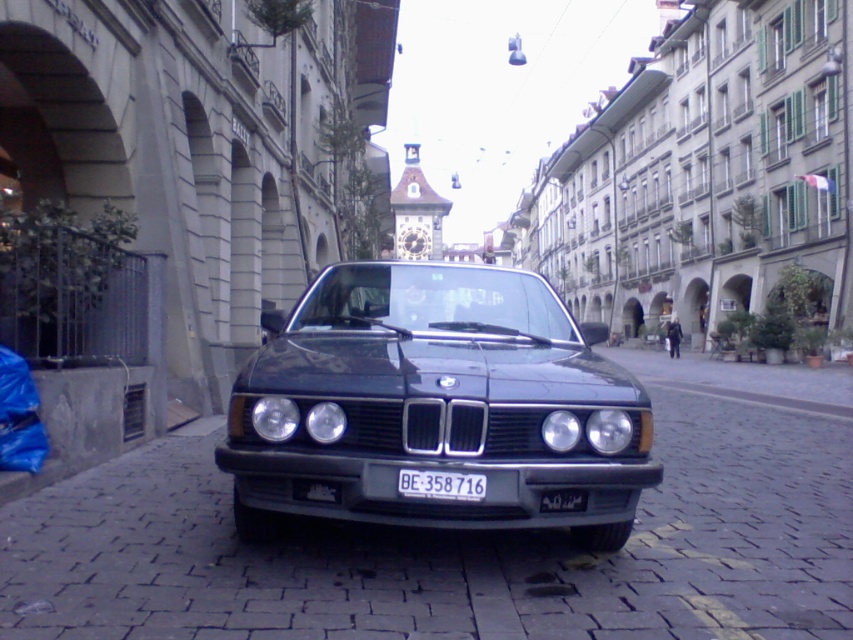
You are a delivery person trying to park a 2.5m long car in the space where the shiny dark green car at center is currently parked. The parking space is 4 meters long. Can you fit your car in this space?

The parking space is 4 meters long, and your car is 2.5 meters long, so yes, your car can fit in the space where the shiny dark green car at center is parked.

You are standing in front of the vintage BMW car on the cobblestone street. There are two points marked on the car, one at coordinates point (316, 625) and another at point (271, 438). Which point is closer to you?

Point (316, 625) is closer to the camera than point (271, 438).

You are a photographer trying to capture the matte black car at center and the white plastic license plate at center in a single shot. Based on their positions, which object should you focus on first to ensure both are in frame?

The matte black car at center is located below the white plastic license plate at center, so you should focus on the white plastic license plate at center first to ensure both are in frame.